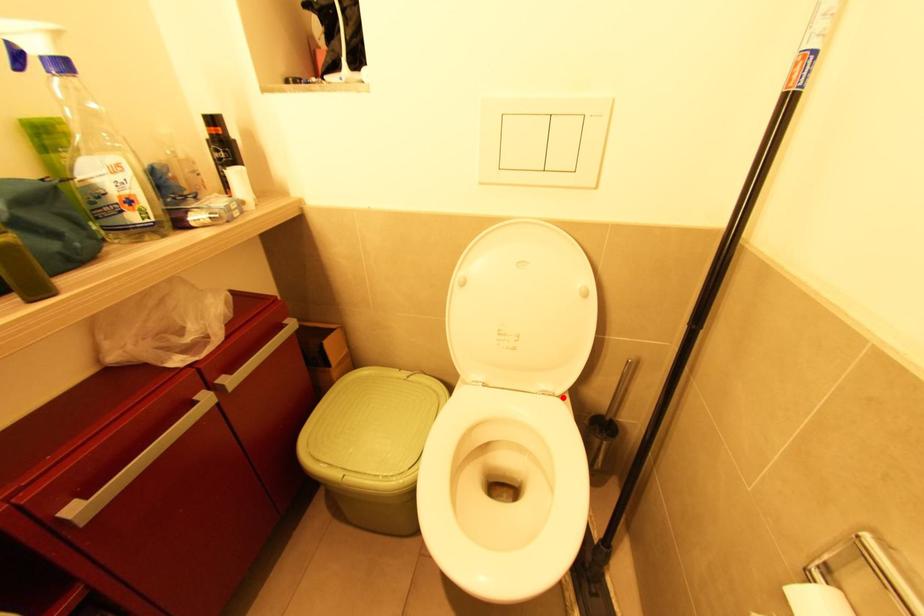
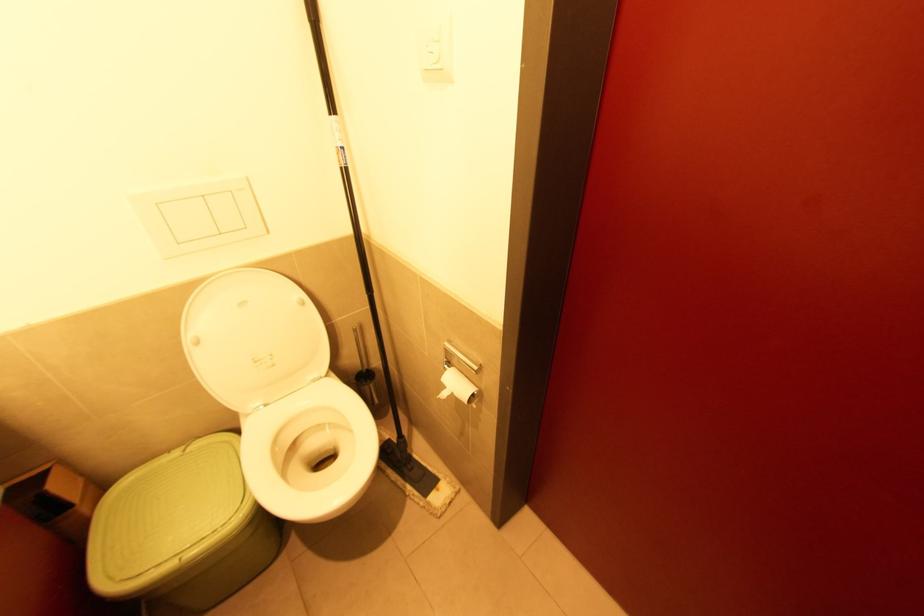
In the second image, find the point that corresponds to the highlighted location in the first image.

(329, 377)